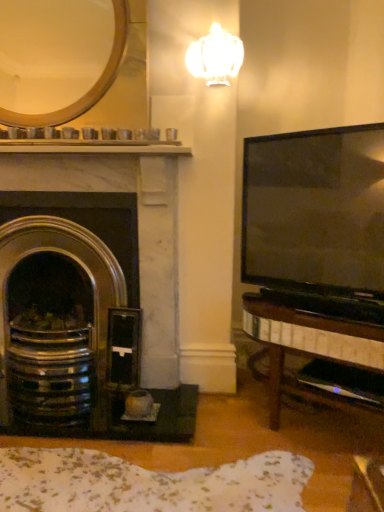
Question: Do you think gold metallic mirror at upper left is within polished brass fireplace at left, or outside of it?

Choices:
 (A) inside
 (B) outside

Answer: (B)

Question: Is gold metallic mirror at upper left wider or thinner than polished brass fireplace at left?

Choices:
 (A) wide
 (B) thin

Answer: (B)

Question: Estimate the real-world distances between objects in this image. Which object is farther from the gold metallic mirror at upper left?

Choices:
 (A) white glossy lamp at upper center
 (B) polished brass fireplace at left

Answer: (B)

Question: Estimate the real-world distances between objects in this image. Which object is farther from the gold metallic mirror at upper left?

Choices:
 (A) white glossy lamp at upper center
 (B) polished brass fireplace at left

Answer: (B)